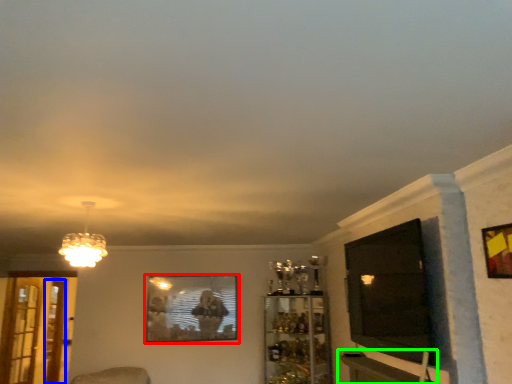
Question: Estimate the real-world distances between objects in this image. Which object is farther from picture frame (highlighted by a red box), screen door (highlighted by a blue box) or table (highlighted by a green box)?

Choices:
 (A) screen door
 (B) table

Answer: (B)